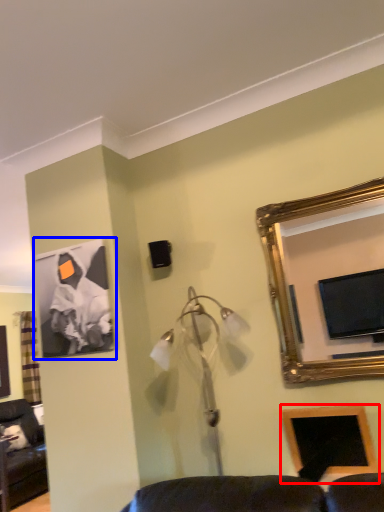
Question: Among these objects, which one is farthest to the camera, picture frame (highlighted by a red box) or picture frame (highlighted by a blue box)?

Choices:
 (A) picture frame
 (B) picture frame

Answer: (B)